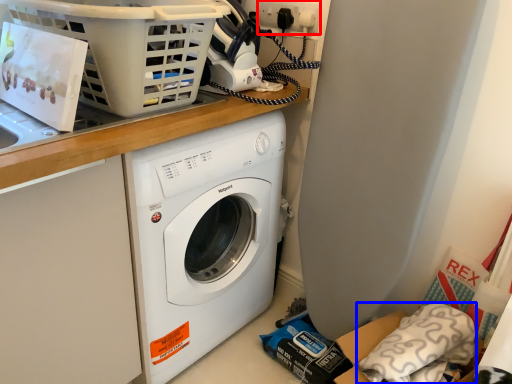
Question: Which of the following is the farthest to the observer, electric outlet (highlighted by a red box) or pillow (highlighted by a blue box)?

Choices:
 (A) electric outlet
 (B) pillow

Answer: (A)